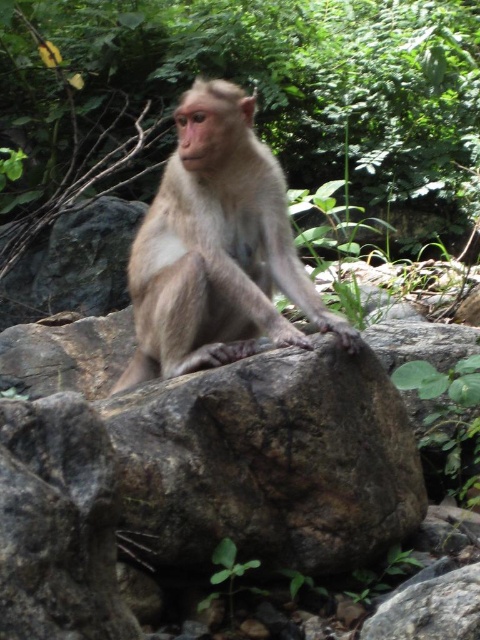
You are a photographer aiming to capture the furry beige monkey at center and the green leafy tree at center in a single frame. Based on their sizes, which one should you focus on to ensure both are clearly visible in the photo?

The green leafy tree at center is larger than the furry beige monkey at center, so focusing on the tree will help ensure both are clearly visible in the photo.

You are a photographer aiming to capture the furry beige monkey at center and the green leafy tree at center in a single frame. Based on their positions, which object is located to the right of the other?

The green leafy tree at center is positioned on the right side of the furry beige monkey at center, so the tree is to the right of the monkey.